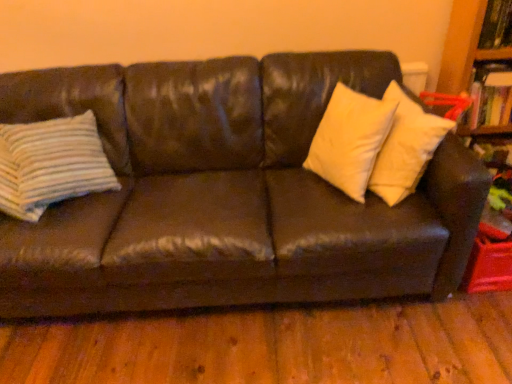
Question: Are striped fabric pillow at left, the second pillow in the right-to-left sequence, and wooden bookcase at upper right located far from each other?

Choices:
 (A) yes
 (B) no

Answer: (A)

Question: Is striped fabric pillow at left, the second pillow in the right-to-left sequence, located outside wooden bookcase at upper right?

Choices:
 (A) yes
 (B) no

Answer: (A)

Question: Does striped fabric pillow at left, placed as the first pillow when sorted from left to right, have a greater height compared to wooden bookcase at upper right?

Choices:
 (A) yes
 (B) no

Answer: (B)

Question: Is striped fabric pillow at left, the second pillow in the right-to-left sequence, placed right next to wooden bookcase at upper right?

Choices:
 (A) yes
 (B) no

Answer: (B)

Question: From a real-world perspective, is striped fabric pillow at left, the second pillow in the right-to-left sequence, over wooden bookcase at upper right?

Choices:
 (A) no
 (B) yes

Answer: (B)

Question: From their relative heights in the image, would you say hardcover book at upper right is taller or shorter than wooden bookcase at upper right?

Choices:
 (A) tall
 (B) short

Answer: (B)

Question: Is hardcover book at upper right wider or thinner than wooden bookcase at upper right?

Choices:
 (A) wide
 (B) thin

Answer: (A)

Question: Is point (473, 119) positioned closer to the camera than point (456, 39)?

Choices:
 (A) closer
 (B) farther

Answer: (B)

Question: Relative to wooden bookcase at upper right, is hardcover book at upper right in front or behind?

Choices:
 (A) front
 (B) behind

Answer: (B)

Question: From the image's perspective, is leather couch at center located above or below wooden bookcase at upper right?

Choices:
 (A) below
 (B) above

Answer: (A)

Question: From a real-world perspective, is leather couch at center positioned above or below wooden bookcase at upper right?

Choices:
 (A) above
 (B) below

Answer: (B)

Question: In the image, is leather couch at center on the left side or the right side of wooden bookcase at upper right?

Choices:
 (A) left
 (B) right

Answer: (A)

Question: In the image, is leather couch at center positioned in front of or behind wooden bookcase at upper right?

Choices:
 (A) behind
 (B) front

Answer: (B)

Question: From their relative heights in the image, would you say hardcover book at upper right is taller or shorter than leather couch at center?

Choices:
 (A) short
 (B) tall

Answer: (A)

Question: In terms of size, does hardcover book at upper right appear bigger or smaller than leather couch at center?

Choices:
 (A) big
 (B) small

Answer: (B)